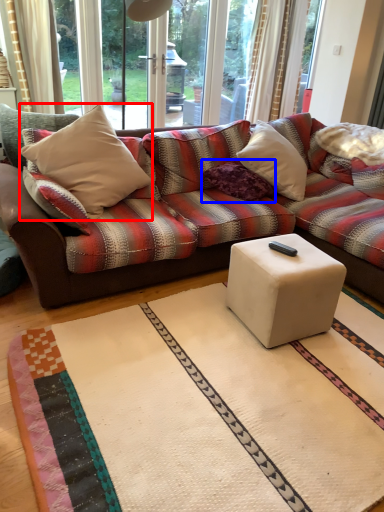
Question: Which object appears closest to the camera in this image, throw pillow (highlighted by a red box) or pillow (highlighted by a blue box)?

Choices:
 (A) throw pillow
 (B) pillow

Answer: (A)